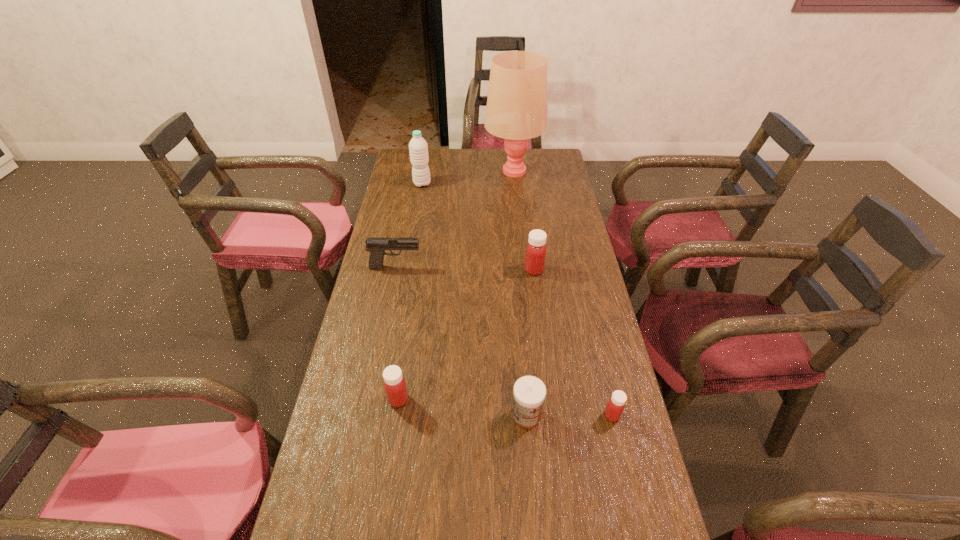
In order to click on the shortest medicine in this screenshot , I will do `click(616, 404)`.

Image resolution: width=960 pixels, height=540 pixels. I want to click on the rightmost medicine, so click(616, 404).

Locate an element on the screen. vacant space located on the left of the tallest object is located at coordinates (464, 171).

Image resolution: width=960 pixels, height=540 pixels. I want to click on free space located 0.230m on the right of the sixth shortest object, so click(486, 184).

Where is `vacant region located on the front of the second red medicine from left to right`? vacant region located on the front of the second red medicine from left to right is located at coordinates (546, 363).

I want to click on free space located 0.310m aim along the barrel of the pistol, so click(514, 267).

Locate an element on the screen. Image resolution: width=960 pixels, height=540 pixels. vacant area situated on the back of the leftmost medicine is located at coordinates (415, 291).

Where is `vacant space situated on the left of the white medicine`? Image resolution: width=960 pixels, height=540 pixels. vacant space situated on the left of the white medicine is located at coordinates (397, 416).

I want to click on vacant space located 0.290m on the back of the smallest red medicine, so click(589, 320).

The height and width of the screenshot is (540, 960). What are the coordinates of `object situated at the far edge` in the screenshot? It's located at (516, 110).